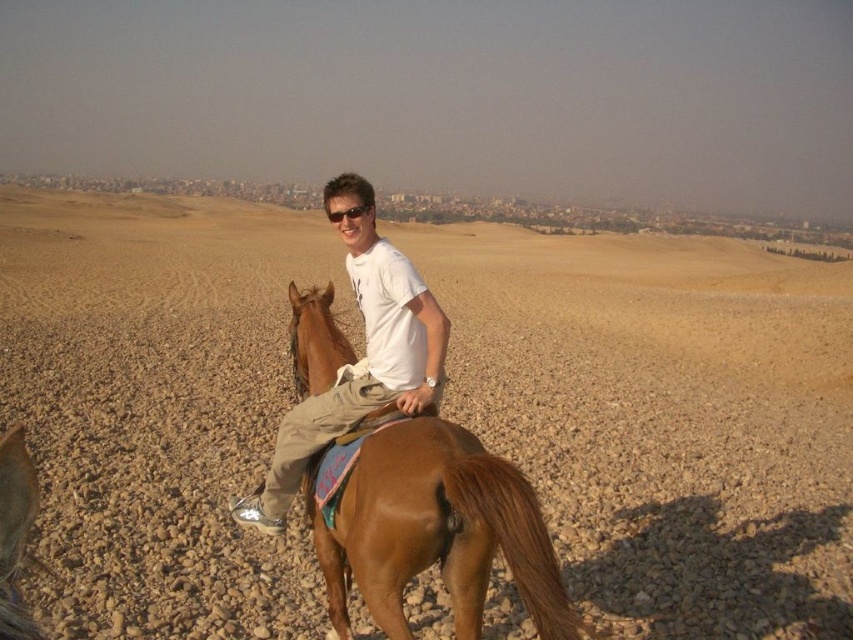
Question: Which point is closer to the camera?

Choices:
 (A) brown gravelly dirt field at center
 (B) matte white shirt at center
 (C) black plastic sunglasses at center

Answer: (B)

Question: Can you confirm if brown gravelly dirt field at center is thinner than brown glossy horse at center?

Choices:
 (A) yes
 (B) no

Answer: (B)

Question: Estimate the real-world distances between objects in this image. Which object is farther from the brown gravelly dirt field at center?

Choices:
 (A) matte white shirt at center
 (B) black plastic sunglasses at center

Answer: (B)

Question: Which object appears closest to the camera in this image?

Choices:
 (A) black plastic sunglasses at center
 (B) matte white shirt at center
 (C) brown gravelly dirt field at center

Answer: (B)

Question: From the image, what is the correct spatial relationship of brown glossy horse at center in relation to matte white shirt at center?

Choices:
 (A) left
 (B) right

Answer: (B)

Question: Does brown gravelly dirt field at center have a larger size compared to matte white shirt at center?

Choices:
 (A) no
 (B) yes

Answer: (B)